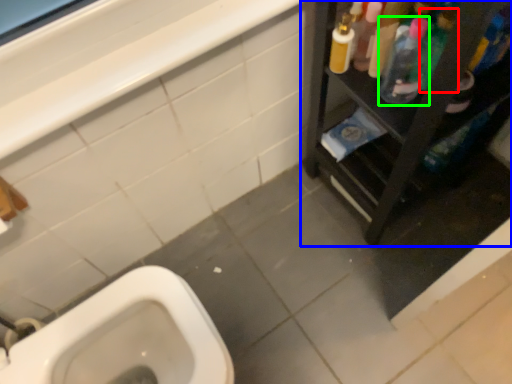
Question: Estimate the real-world distances between objects in this image. Which object is farther from cleaning product (highlighted by a red box), furniture (highlighted by a blue box) or cleaning product (highlighted by a green box)?

Choices:
 (A) furniture
 (B) cleaning product

Answer: (A)